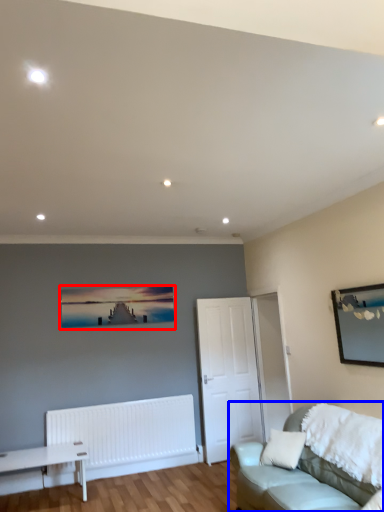
Question: Which of the following is the farthest to the observer, picture frame (highlighted by a red box) or studio couch (highlighted by a blue box)?

Choices:
 (A) picture frame
 (B) studio couch

Answer: (A)